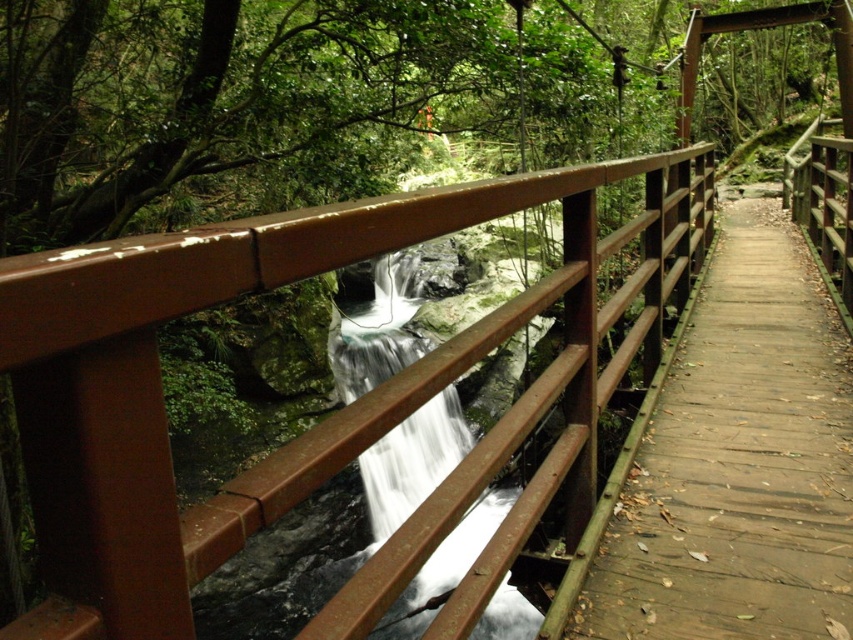
Question: Is brown wooden rail at center positioned before wooden planks at center?

Choices:
 (A) yes
 (B) no

Answer: (B)

Question: Which object appears closest to the camera in this image?

Choices:
 (A) wooden planks at center
 (B) brown wooden rail at center
 (C) white smooth water at center

Answer: (C)

Question: Can you confirm if brown wooden rail at center is positioned to the left of white smooth water at center?

Choices:
 (A) yes
 (B) no

Answer: (B)

Question: Which object appears farthest from the camera in this image?

Choices:
 (A) white smooth water at center
 (B) brown wooden rail at center

Answer: (B)

Question: Can you confirm if brown wooden rail at center is wider than wooden planks at center?

Choices:
 (A) yes
 (B) no

Answer: (B)

Question: Estimate the real-world distances between objects in this image. Which object is closer to the brown wooden rail at center?

Choices:
 (A) wooden planks at center
 (B) white smooth water at center

Answer: (A)